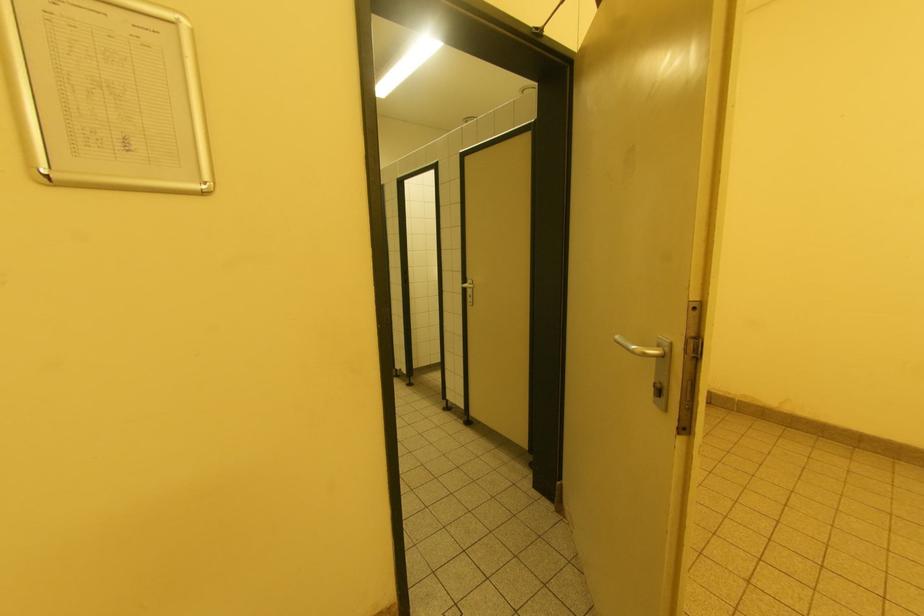
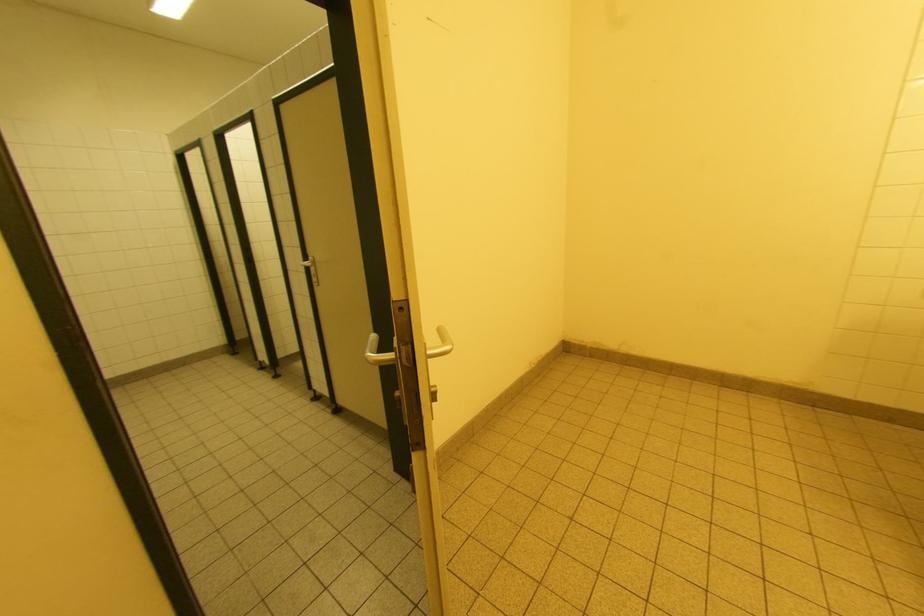
Question: The images are taken continuously from a first-person perspective. In which direction are you moving?

Choices:
 (A) Left
 (B) Right
 (C) Forward
 (D) Backward

Answer: (B)